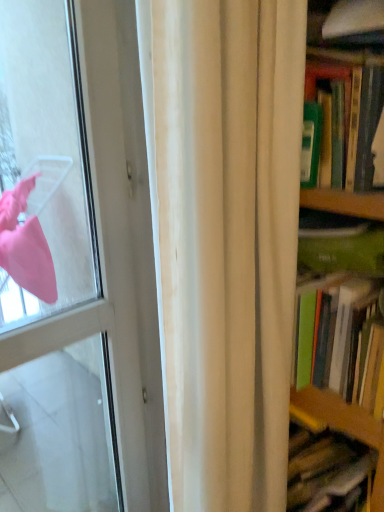
Question: Is white fabric curtain at center further to the viewer compared to white glossy door at left?

Choices:
 (A) yes
 (B) no

Answer: (B)

Question: Can you confirm if white fabric curtain at center is taller than white glossy door at left?

Choices:
 (A) no
 (B) yes

Answer: (A)

Question: Is white fabric curtain at center aimed at white glossy door at left?

Choices:
 (A) no
 (B) yes

Answer: (A)

Question: Are white fabric curtain at center and white glossy door at left located far from each other?

Choices:
 (A) yes
 (B) no

Answer: (B)

Question: Are white fabric curtain at center and white glossy door at left beside each other?

Choices:
 (A) no
 (B) yes

Answer: (A)

Question: From a real-world perspective, is white fabric curtain at center over white glossy door at left?

Choices:
 (A) yes
 (B) no

Answer: (A)

Question: From a real-world perspective, is white glossy door at left positioned over green matte book at right based on gravity?

Choices:
 (A) yes
 (B) no

Answer: (B)

Question: Considering the relative sizes of white glossy door at left and green matte book at right in the image provided, is white glossy door at left smaller than green matte book at right?

Choices:
 (A) yes
 (B) no

Answer: (B)

Question: Are white glossy door at left and green matte book at right far apart?

Choices:
 (A) yes
 (B) no

Answer: (B)

Question: From a real-world perspective, is white glossy door at left beneath green matte book at right?

Choices:
 (A) no
 (B) yes

Answer: (B)

Question: Does white glossy door at left have a lesser height compared to green matte book at right?

Choices:
 (A) yes
 (B) no

Answer: (B)

Question: Is white glossy door at left wider than green matte book at right?

Choices:
 (A) yes
 (B) no

Answer: (B)

Question: Can you confirm if green matte book at right is smaller than white glossy door at left?

Choices:
 (A) no
 (B) yes

Answer: (B)